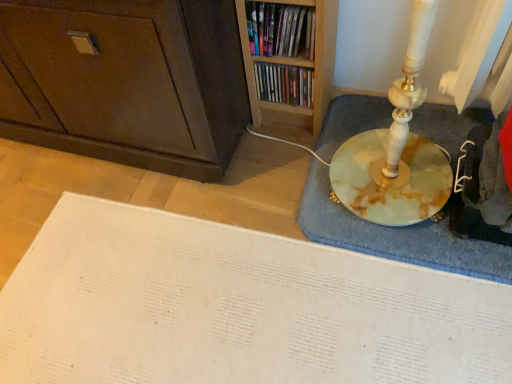
The width and height of the screenshot is (512, 384). What do you see at coordinates (397, 237) in the screenshot? I see `marble bath mat at right` at bounding box center [397, 237].

The height and width of the screenshot is (384, 512). What do you see at coordinates (280, 29) in the screenshot?
I see `wooden bookshelf at upper center, arranged as the second book when viewed from the back` at bounding box center [280, 29].

In order to face wooden bookshelf at upper center, arranged as the second book when viewed from the back, should I rotate leftwards or rightwards?

Turn right by 3.422 degrees to look at wooden bookshelf at upper center, arranged as the second book when viewed from the back.

Where is `dark brown wood cabinet at lower left`? This screenshot has width=512, height=384. dark brown wood cabinet at lower left is located at coordinates (127, 81).

Is matte plastic books at upper center, which appears as the second book when viewed from the front, completely or partially outside of wooden bookshelf at upper center, the first book when ordered from front to back?

Yes.

Does matte plastic books at upper center, which appears as the second book when viewed from the front, have a lesser height compared to wooden bookshelf at upper center, the first book when ordered from front to back?

No.

Considering the relative positions of matte plastic books at upper center, acting as the 1th book starting from the back, and wooden bookshelf at upper center, the first book when ordered from front to back, in the image provided, is matte plastic books at upper center, acting as the 1th book starting from the back, to the right of wooden bookshelf at upper center, the first book when ordered from front to back, from the viewer's perspective?

Indeed, matte plastic books at upper center, acting as the 1th book starting from the back, is positioned on the right side of wooden bookshelf at upper center, the first book when ordered from front to back.

In terms of width, does matte plastic books at upper center, acting as the 1th book starting from the back, look wider or thinner when compared to wooden bookshelf at upper center, the first book when ordered from front to back?

Clearly, matte plastic books at upper center, acting as the 1th book starting from the back, has less width compared to wooden bookshelf at upper center, the first book when ordered from front to back.

What's the angular difference between marble bath mat at right and matte plastic books at upper center, acting as the 1th book starting from the back,'s facing directions?

0.00274 degrees separate the facing orientations of marble bath mat at right and matte plastic books at upper center, acting as the 1th book starting from the back.

Would you say marble bath mat at right is to the left or to the right of matte plastic books at upper center, which appears as the second book when viewed from the front, in the picture?

From the image, it's evident that marble bath mat at right is to the right of matte plastic books at upper center, which appears as the second book when viewed from the front.

Would you say marble bath mat at right is outside matte plastic books at upper center, acting as the 1th book starting from the back?

Yes.

Does point (261, 19) appear closer or farther from the camera than point (282, 100)?

Point (261, 19) is positioned closer to the camera compared to point (282, 100).

From a real-world perspective, is wooden bookshelf at upper center, the first book when ordered from front to back, below matte plastic books at upper center, acting as the 1th book starting from the back?

Result: No.

Considering the positions of objects wooden bookshelf at upper center, arranged as the second book when viewed from the back, and matte plastic books at upper center, which appears as the second book when viewed from the front, in the image provided, who is more to the left, wooden bookshelf at upper center, arranged as the second book when viewed from the back, or matte plastic books at upper center, which appears as the second book when viewed from the front,?

From the viewer's perspective, wooden bookshelf at upper center, arranged as the second book when viewed from the back, appears more on the left side.

This screenshot has height=384, width=512. Find the location of `book directly beneath the wooden bookshelf at upper center, arranged as the second book when viewed from the back (from a real-world perspective)`. book directly beneath the wooden bookshelf at upper center, arranged as the second book when viewed from the back (from a real-world perspective) is located at coordinates (284, 84).

Is there a large distance between wooden bookshelf at upper center, the first book when ordered from front to back, and marble bath mat at right?

No.

The width and height of the screenshot is (512, 384). I want to click on bath mat below the wooden bookshelf at upper center, the first book when ordered from front to back (from the image's perspective), so click(397, 237).

From a real-world perspective, is wooden bookshelf at upper center, arranged as the second book when viewed from the back, physically above marble bath mat at right?

Indeed, from a real-world perspective, wooden bookshelf at upper center, arranged as the second book when viewed from the back, stands above marble bath mat at right.

Visually, is marble bath mat at right positioned to the left or to the right of wooden bookshelf at upper center, the first book when ordered from front to back?

marble bath mat at right is positioned on wooden bookshelf at upper center, the first book when ordered from front to back,'s right side.

Consider the image. Which of these two, marble bath mat at right or wooden bookshelf at upper center, arranged as the second book when viewed from the back, stands taller?

wooden bookshelf at upper center, arranged as the second book when viewed from the back.

How different are the orientations of marble bath mat at right and wooden bookshelf at upper center, arranged as the second book when viewed from the back, in degrees?

The angular difference between marble bath mat at right and wooden bookshelf at upper center, arranged as the second book when viewed from the back, is 0.00274 degrees.

In the scene shown: Considering their positions, is matte plastic books at upper center, acting as the 1th book starting from the back, located in front of or behind dark brown wood cabinet at lower left?

In the image, matte plastic books at upper center, acting as the 1th book starting from the back, appears behind dark brown wood cabinet at lower left.

Based on the photo, considering the sizes of objects matte plastic books at upper center, which appears as the second book when viewed from the front, and dark brown wood cabinet at lower left in the image provided, who is shorter, matte plastic books at upper center, which appears as the second book when viewed from the front, or dark brown wood cabinet at lower left?

matte plastic books at upper center, which appears as the second book when viewed from the front, is shorter.

From a real-world perspective, is matte plastic books at upper center, which appears as the second book when viewed from the front, over dark brown wood cabinet at lower left?

No, from a real-world perspective, matte plastic books at upper center, which appears as the second book when viewed from the front, is not over dark brown wood cabinet at lower left

This screenshot has width=512, height=384. There is a marble bath mat at right. Find the location of `the 1st book above it (from a real-world perspective)`. the 1st book above it (from a real-world perspective) is located at coordinates (284, 84).

How different are the orientations of matte plastic books at upper center, acting as the 1th book starting from the back, and marble bath mat at right in degrees?

0.00274 degrees separate the facing orientations of matte plastic books at upper center, acting as the 1th book starting from the back, and marble bath mat at right.

Between matte plastic books at upper center, which appears as the second book when viewed from the front, and marble bath mat at right, which one has larger width?

With larger width is marble bath mat at right.

From a real-world perspective, between matte plastic books at upper center, which appears as the second book when viewed from the front, and marble bath mat at right, who is vertically higher?

matte plastic books at upper center, which appears as the second book when viewed from the front, from a real-world perspective.

Where is `book behind the wooden bookshelf at upper center, the first book when ordered from front to back`? This screenshot has width=512, height=384. book behind the wooden bookshelf at upper center, the first book when ordered from front to back is located at coordinates (284, 84).

In the image, there is a matte plastic books at upper center, acting as the 1th book starting from the back. Find the location of `bath mat below it (from a real-world perspective)`. bath mat below it (from a real-world perspective) is located at coordinates (397, 237).

When comparing their distances from marble bath mat at right, does matte plastic books at upper center, acting as the 1th book starting from the back, or dark brown wood cabinet at lower left seem further?

dark brown wood cabinet at lower left is further to marble bath mat at right.

When comparing their distances from matte plastic books at upper center, acting as the 1th book starting from the back, does wooden bookshelf at upper center, the first book when ordered from front to back, or marble bath mat at right seem closer?

Based on the image, wooden bookshelf at upper center, the first book when ordered from front to back, appears to be nearer to matte plastic books at upper center, acting as the 1th book starting from the back.

Which object lies nearer to the anchor point wooden bookshelf at upper center, arranged as the second book when viewed from the back, marble bath mat at right or dark brown wood cabinet at lower left?

Among the two, dark brown wood cabinet at lower left is located nearer to wooden bookshelf at upper center, arranged as the second book when viewed from the back.

Considering their positions, is wooden bookshelf at upper center, arranged as the second book when viewed from the back, positioned closer to dark brown wood cabinet at lower left than marble bath mat at right?

wooden bookshelf at upper center, arranged as the second book when viewed from the back.

From the image, which object appears to be farther from marble bath mat at right, wooden bookshelf at upper center, arranged as the second book when viewed from the back, or dark brown wood cabinet at lower left?

Based on the image, dark brown wood cabinet at lower left appears to be further to marble bath mat at right.

Estimate the real-world distances between objects in this image. Which object is further from wooden bookshelf at upper center, the first book when ordered from front to back, marble bath mat at right or matte plastic books at upper center, which appears as the second book when viewed from the front?

marble bath mat at right is further to wooden bookshelf at upper center, the first book when ordered from front to back.

Considering their positions, is dark brown wood cabinet at lower left positioned closer to wooden bookshelf at upper center, arranged as the second book when viewed from the back, than matte plastic books at upper center, acting as the 1th book starting from the back?

matte plastic books at upper center, acting as the 1th book starting from the back, is positioned closer to the anchor wooden bookshelf at upper center, arranged as the second book when viewed from the back.

Looking at this image, based on their spatial positions, is matte plastic books at upper center, acting as the 1th book starting from the back, or dark brown wood cabinet at lower left closer to wooden bookshelf at upper center, the first book when ordered from front to back?

Based on the image, matte plastic books at upper center, acting as the 1th book starting from the back, appears to be nearer to wooden bookshelf at upper center, the first book when ordered from front to back.

Find the location of a particular element. book situated between wooden bookshelf at upper center, arranged as the second book when viewed from the back, and marble bath mat at right from left to right is located at coordinates (284, 84).

At what (x,y) coordinates should I click in order to perform the action: click on book located between dark brown wood cabinet at lower left and matte plastic books at upper center, which appears as the second book when viewed from the front, in the left-right direction. Please return your answer as a coordinate pair (x, y). Looking at the image, I should click on (280, 29).